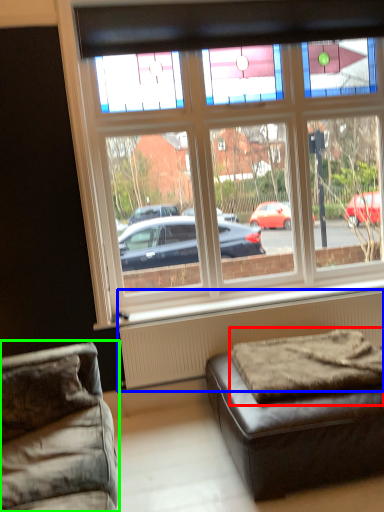
Question: Based on their relative distances, which object is nearer to mattress (highlighted by a red box)? Choose from radiator (highlighted by a blue box) and studio couch (highlighted by a green box).

Choices:
 (A) radiator
 (B) studio couch

Answer: (A)